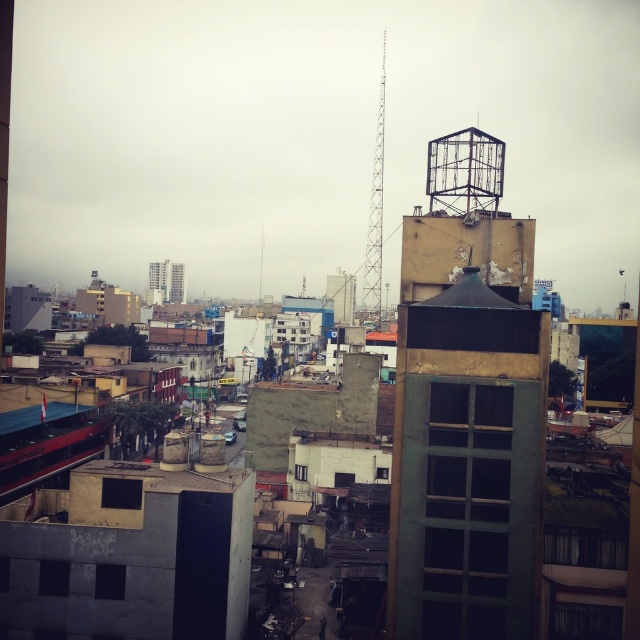
You are a city planner assessing the urban layout. You need to install a new communication tower that must be at least 300 meters away from any existing buildings to comply with safety regulations. Based on the scene, is the distance between the rusty metal tower at upper right and the smooth concrete building at center sufficient?

The rusty metal tower at upper right and the smooth concrete building at center are 279.69 meters apart. Since the required distance is 300 meters, the current separation is insufficient to meet safety regulations.

You are a city planner reviewing this area and need to assess which object is wider. Based on the scene, which is narrower between the rusty metal tower at upper right and the smooth concrete building at center?

The rusty metal tower at upper right is narrower than the smooth concrete building at center.

You are a city planner reviewing this area. There is a point at coordinates (x=467, y=410) in the image. According to the provided information, what object is this point located on?

The point at coordinates (x=467, y=410) is located on the rusty metal tower at upper right.